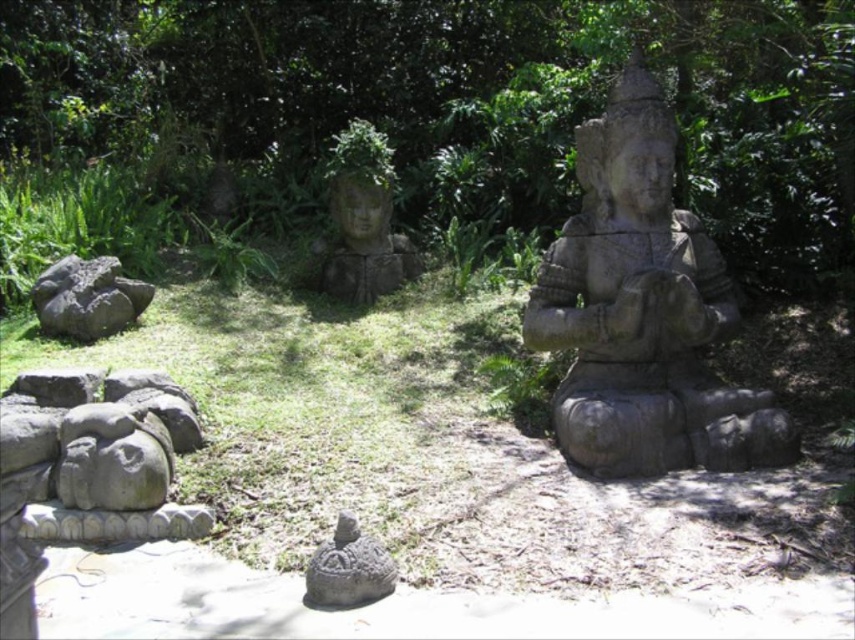
You are a visitor in this garden and want to take a photo of the gray stone statue at center without any obstructions. Is the gray stone head at lower left blocking your view?

The gray stone head at lower left is behind the gray stone statue at center, so it won not block your view when taking a photo of the gray stone statue at center.

You are a photographer standing in the garden where the gray stone statue at center is located. You want to take a photo of the statue from a distance that allows you to capture it in full without cropping any part of it. If your camera has a maximum zoom range that can capture objects up to 3 meters away, will you be able to take the photo without moving closer?

The gray stone statue at center is 3.33 meters away from the camera. Since the camera can only capture up to 3 meters, you will need to move closer to ensure the entire statue fits in the frame without cropping.

You are a photographer trying to capture the exact center of the image. According to the coordinates provided, where should you position your camera to focus on the gray stone statue at center?

The gray stone statue at center is located at the 2D coordinates point (643, 310), so you should position your camera to focus there.